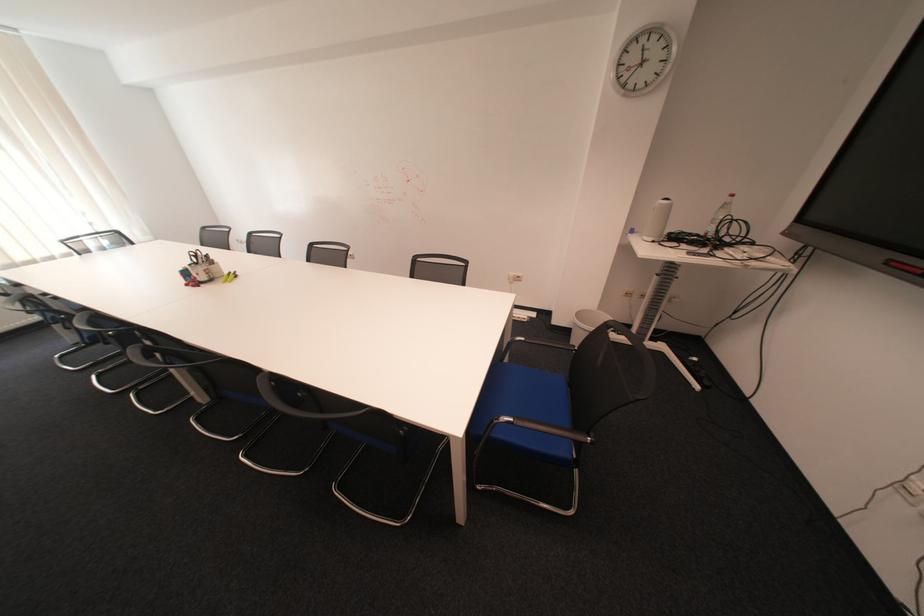
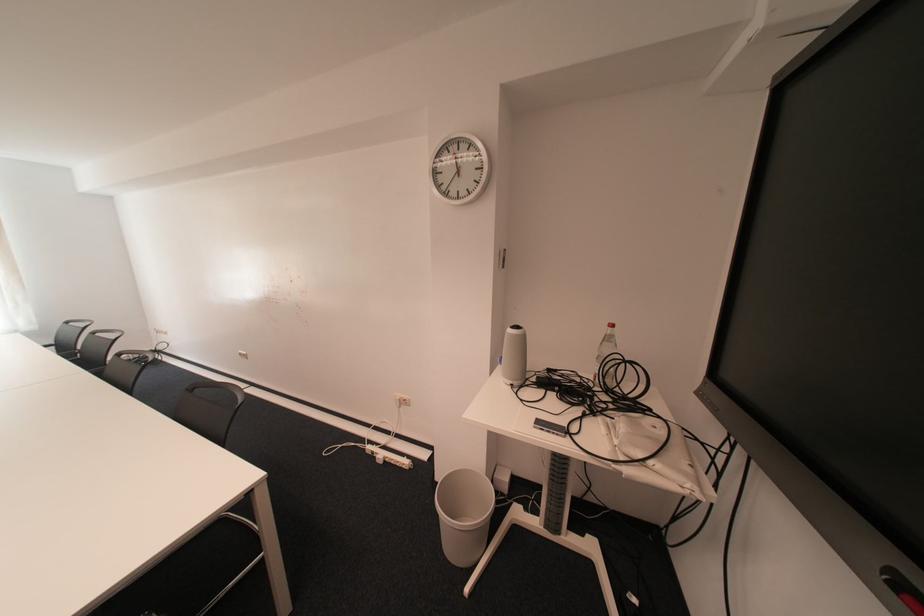
In the second image, find the point that corresponds to (733,208) in the first image.

(614, 341)